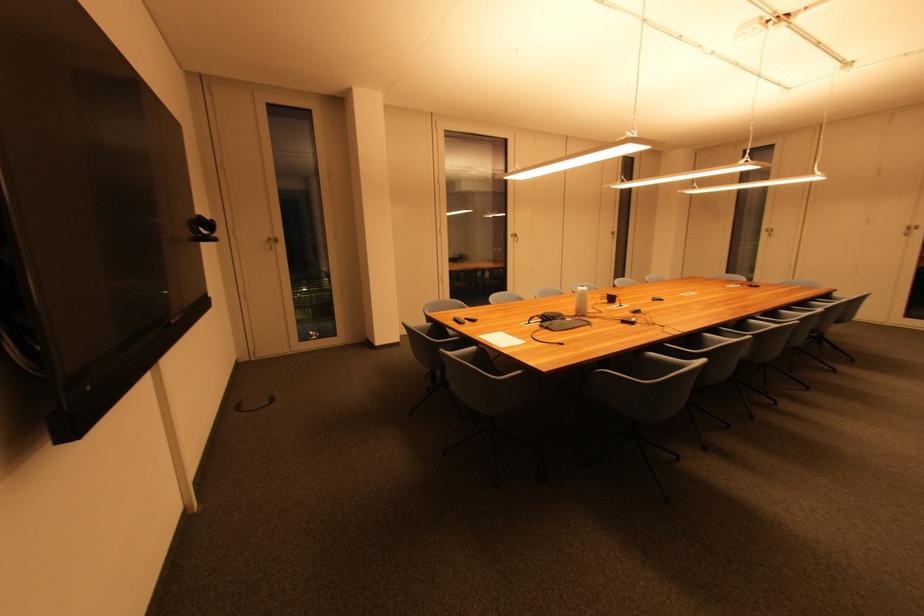
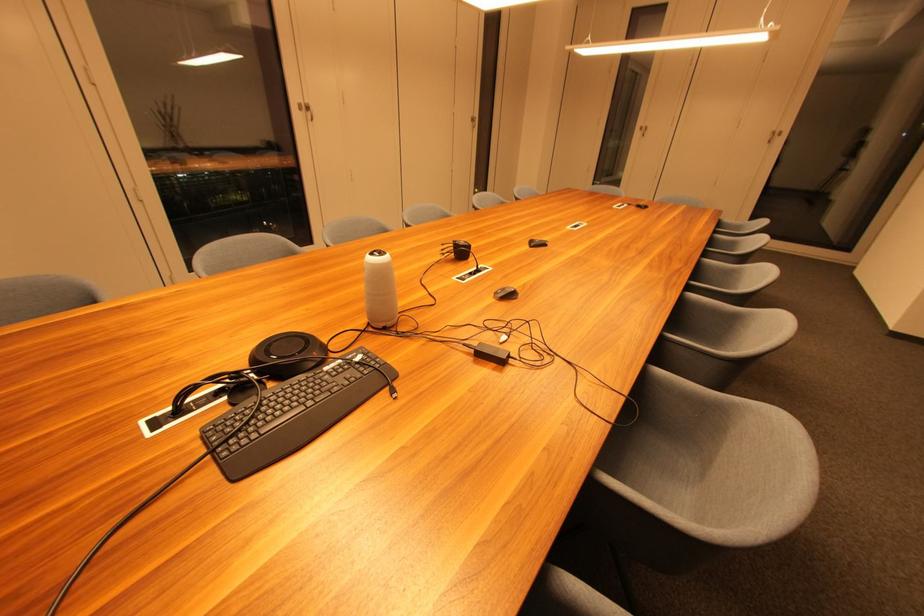
Where in the second image is the point corresponding to pixel 517 238 from the first image?

(306, 111)